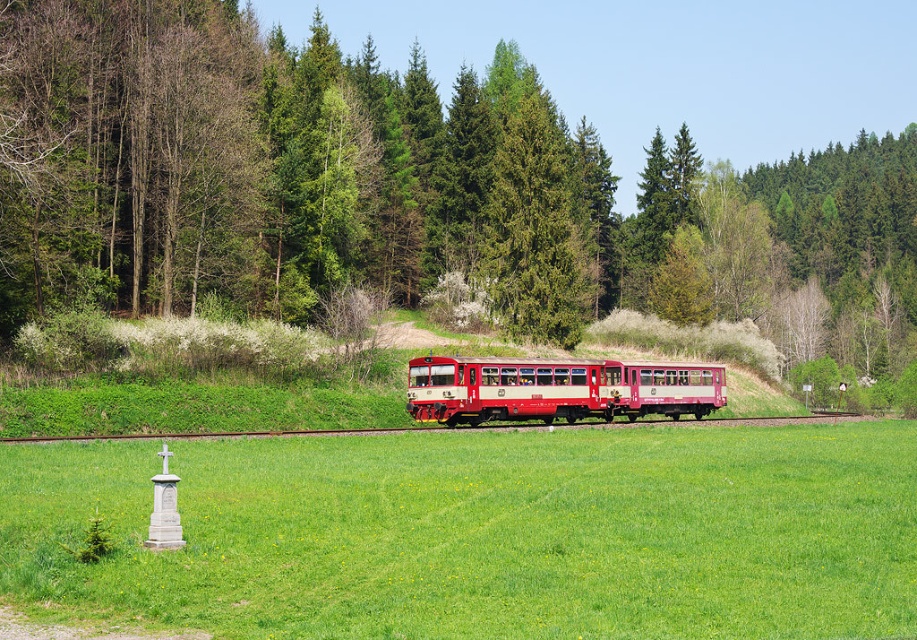
Question: Does green grassy field at lower center come behind green textured pine tree at center?

Choices:
 (A) yes
 (B) no

Answer: (B)

Question: Which of these objects is positioned farthest from the green textured pine tree at center?

Choices:
 (A) matte red train at center
 (B) green grassy field at lower center

Answer: (B)

Question: Estimate the real-world distances between objects in this image. Which object is closer to the green textured pine tree at center?

Choices:
 (A) matte red train at center
 (B) green grassy field at lower center

Answer: (A)

Question: Which object is closer to the camera taking this photo?

Choices:
 (A) green grassy field at lower center
 (B) green textured pine tree at center

Answer: (A)

Question: Can you confirm if green grassy field at lower center is positioned above matte red train at center?

Choices:
 (A) no
 (B) yes

Answer: (B)

Question: Is green grassy field at lower center to the left of matte red train at center from the viewer's perspective?

Choices:
 (A) no
 (B) yes

Answer: (B)